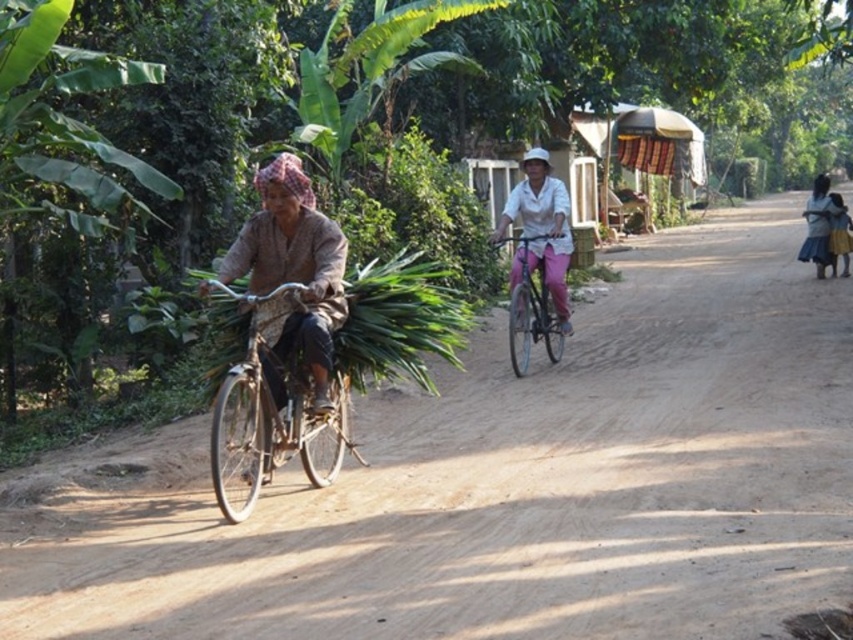
Question: Is brown dirt track at center positioned in front of metallic silver bicycle at center?

Choices:
 (A) yes
 (B) no

Answer: (A)

Question: Which of the following is the farthest from the observer?

Choices:
 (A) brown dirt track at center
 (B) brown textured fabric at center
 (C) metallic silver bicycle at left

Answer: (B)

Question: Is brown textured fabric at center to the right of white matte bicycle at center from the viewer's perspective?

Choices:
 (A) yes
 (B) no

Answer: (B)

Question: Is brown dirt track at center wider than blue denim skirt at right?

Choices:
 (A) yes
 (B) no

Answer: (B)

Question: Which of the following is the farthest from the observer?

Choices:
 (A) blue denim skirt at right
 (B) white matte bicycle at center

Answer: (A)

Question: Which of the following is the farthest from the observer?

Choices:
 (A) metallic silver bicycle at left
 (B) metallic silver bicycle at center
 (C) blue denim skirt at right

Answer: (C)